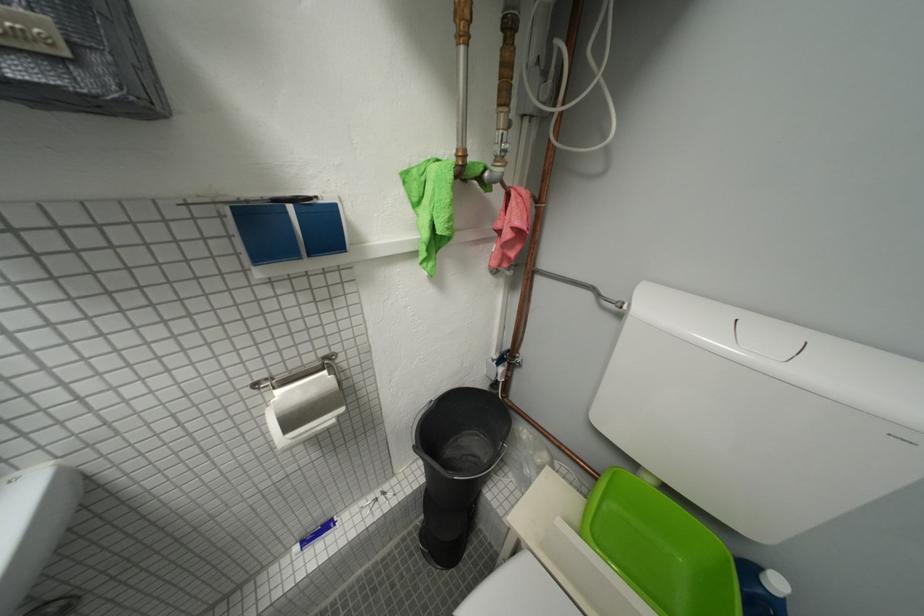
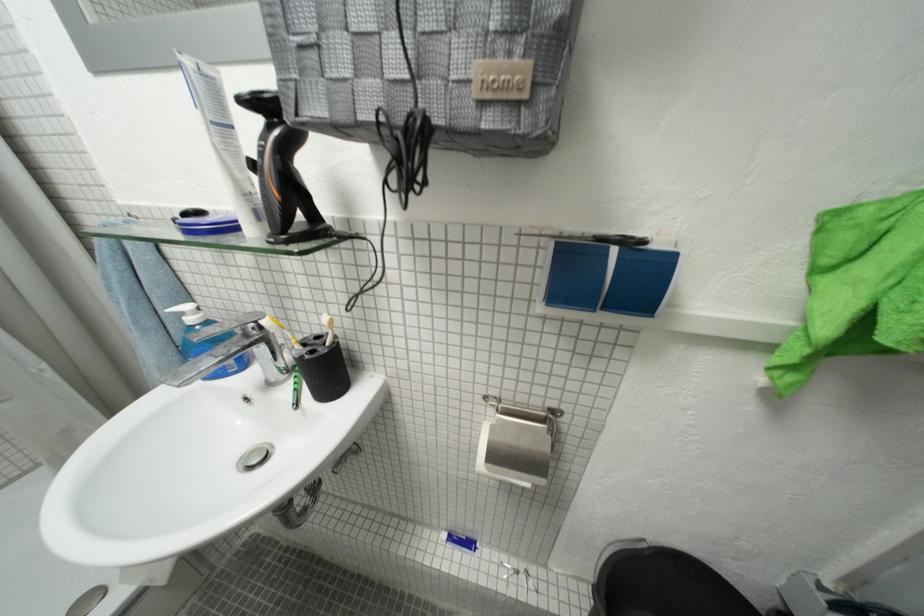
Locate, in the second image, the point that corresponds to (x=306, y=549) in the first image.

(454, 538)